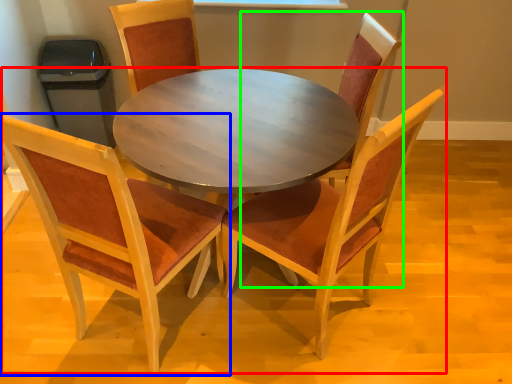
Question: Which object is positioned closest to kitchen & dining room table (highlighted by a red box)? Select from chair (highlighted by a blue box) and chair (highlighted by a green box).

Choices:
 (A) chair
 (B) chair

Answer: (A)